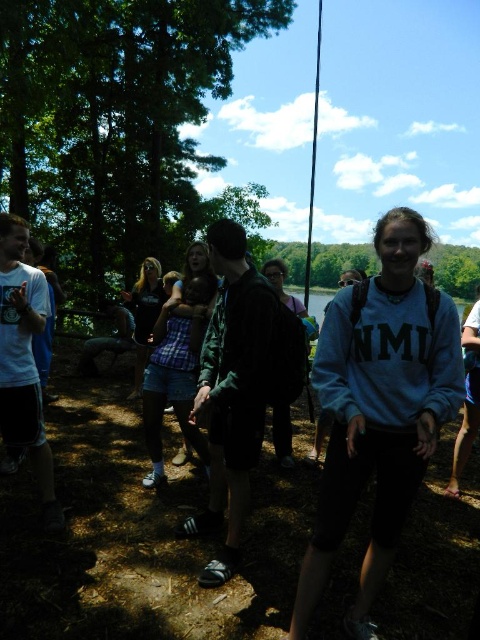
Question: Estimate the real-world distances between objects in this image. Which object is farther from the plaid fabric child at center?

Choices:
 (A) black plastic fishing pole at center
 (B) gray fleece sweatshirt at center

Answer: (A)

Question: Does gray fleece sweatshirt at center have a larger size compared to plaid fabric child at center?

Choices:
 (A) no
 (B) yes

Answer: (B)

Question: Which is farther from the plaid fabric child at center?

Choices:
 (A) black plastic fishing pole at center
 (B) gray fleece sweatshirt at center

Answer: (A)

Question: Estimate the real-world distances between objects in this image. Which object is closer to the black plastic fishing pole at center?

Choices:
 (A) plaid fabric child at center
 (B) gray fleece sweatshirt at center

Answer: (B)

Question: Does gray fleece sweatshirt at center have a greater width compared to black plastic fishing pole at center?

Choices:
 (A) no
 (B) yes

Answer: (A)

Question: Is gray fleece sweatshirt at center thinner than black plastic fishing pole at center?

Choices:
 (A) no
 (B) yes

Answer: (B)